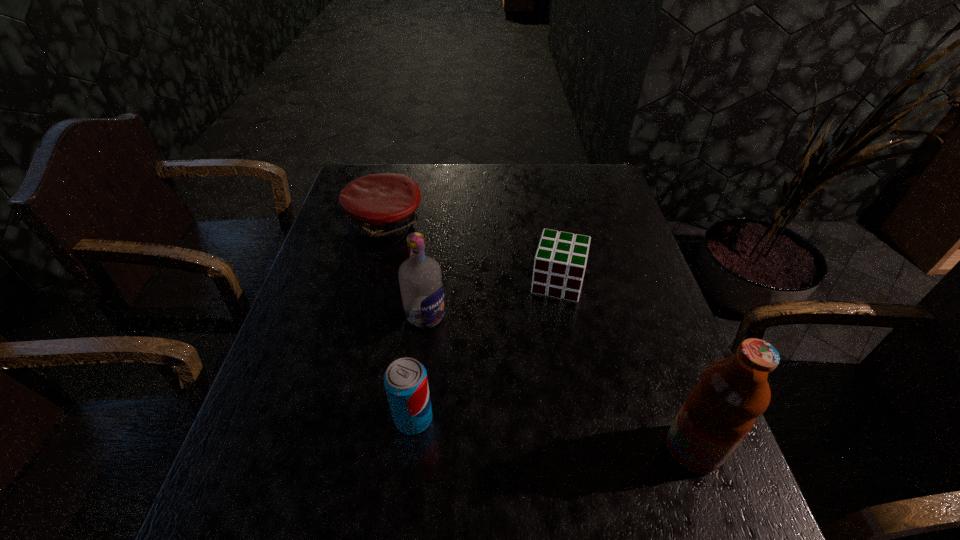
Locate an element on the screen. The image size is (960, 540). vacant space that satisfies the following two spatial constraints: 1. on the front side of the fruit juice; 2. on the front label of the vodka is located at coordinates (410, 449).

At what (x,y) coordinates should I click in order to perform the action: click on free point that satisfies the following two spatial constraints: 1. on the front side of the fourth shortest object; 2. on the right side of the soda can. Please return your answer as a coordinate pair (x, y). Looking at the image, I should click on (414, 418).